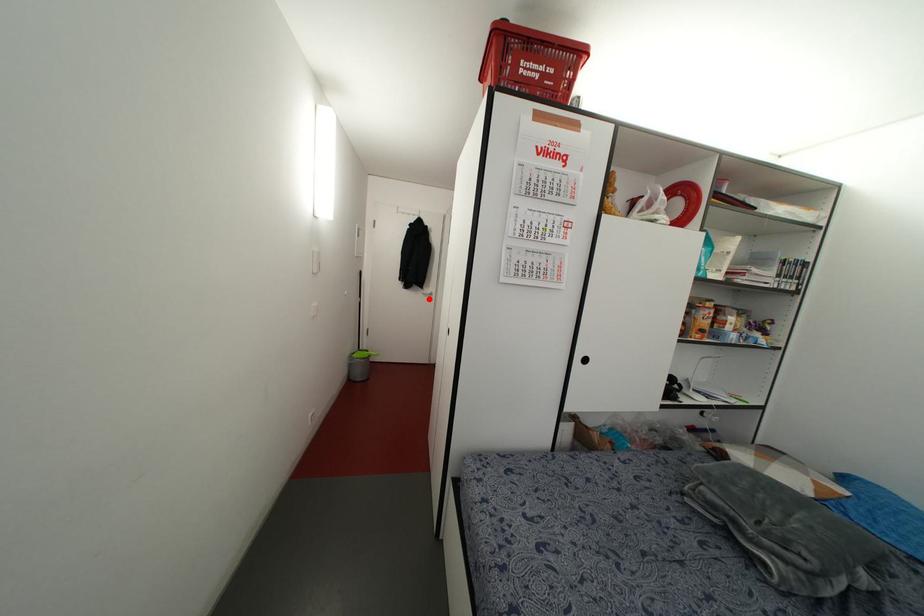
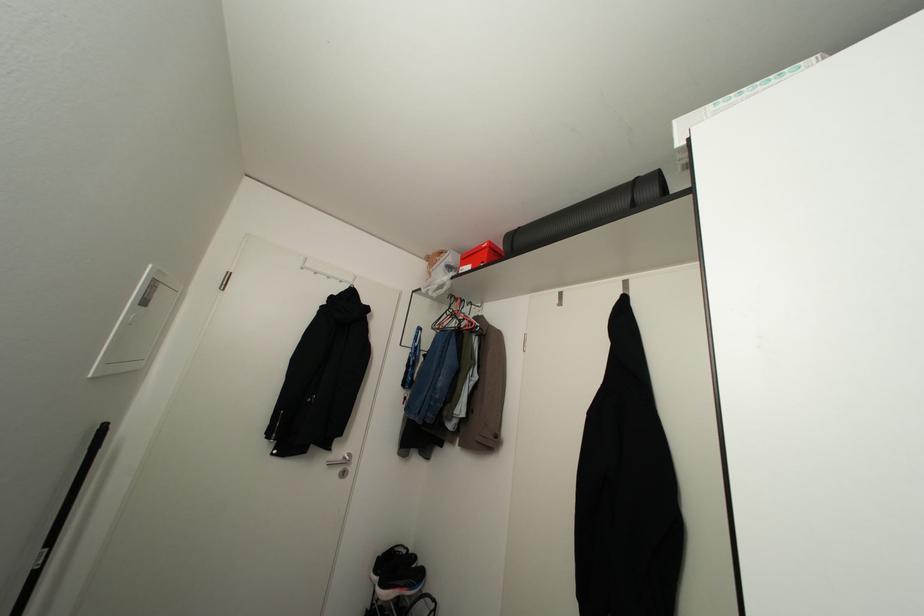
Find the pixel in the second image that matches the highlighted location in the first image.

(343, 472)